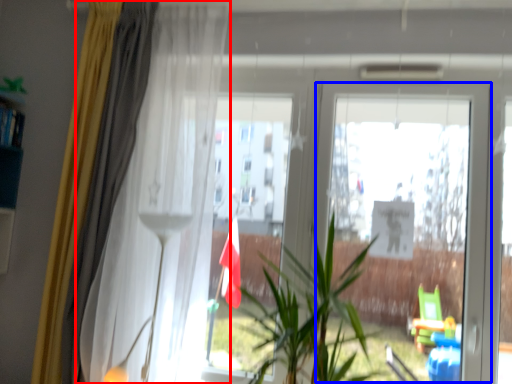
Question: Among these objects, which one is nearest to the camera, curtain (highlighted by a red box) or screen door (highlighted by a blue box)?

Choices:
 (A) curtain
 (B) screen door

Answer: (A)